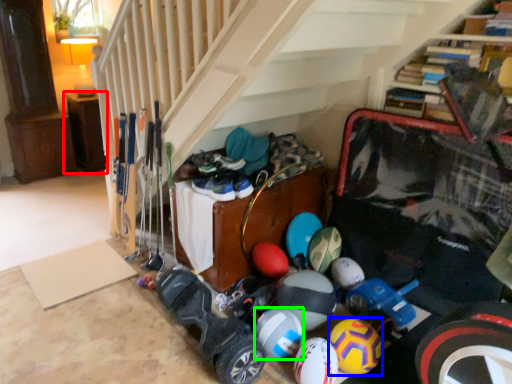
Question: Which is farther away from furniture (highlighted by a red box)? bowling ball (highlighted by a blue box) or bowling ball (highlighted by a green box)?

Choices:
 (A) bowling ball
 (B) bowling ball

Answer: (A)